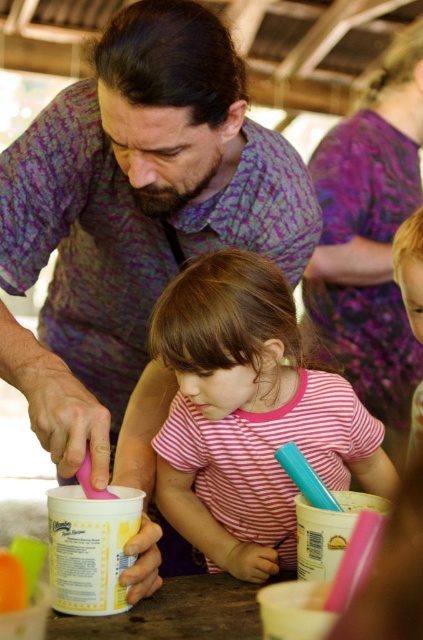
Who is taller, purple batik shirt at upper center or blonde hair at upper right?

purple batik shirt at upper center is taller.

Between point (310, 314) and point (409, 307), which one is positioned in front?

Point (409, 307)

The width and height of the screenshot is (423, 640). I want to click on purple batik shirt at upper center, so coord(370,236).

Is point (216, 529) farther from viewer compared to point (422, 282)?

Yes, it is behind point (422, 282).

Does pink striped shirt at center appear on the right side of blonde hair at upper right?

Incorrect, pink striped shirt at center is not on the right side of blonde hair at upper right.

Does point (181, 408) lie behind point (412, 259)?

Yes.

Where is `pink striped shirt at center`? pink striped shirt at center is located at coordinates (249, 416).

Can you confirm if purple tie-dye shirt at center is positioned below blonde hair at upper right?

No, purple tie-dye shirt at center is not below blonde hair at upper right.

Can you confirm if purple tie-dye shirt at center is thinner than blonde hair at upper right?

No.

Who is more distant from viewer, (112, 211) or (417, 444)?

Positioned behind is point (112, 211).

The height and width of the screenshot is (640, 423). What are the coordinates of `purple tie-dye shirt at center` in the screenshot? It's located at (134, 225).